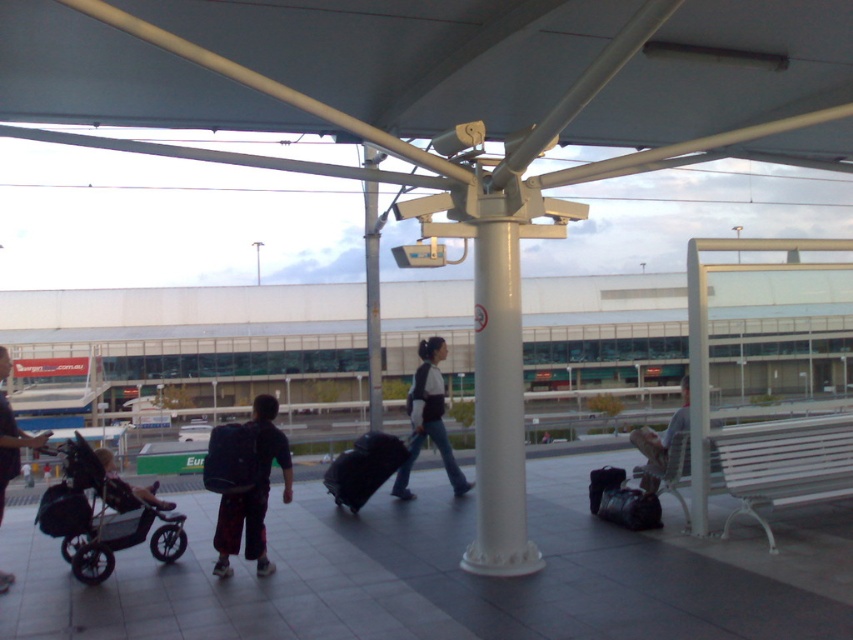
Question: Which object appears farthest from the camera in this image?

Choices:
 (A) black fabric suitcase at center
 (B) dark blue backpack at lower left
 (C) light brown fabric bag at center
 (D) matte black backpack at center

Answer: (D)

Question: Is dark blue backpack at center thinner than light brown fabric bag at center?

Choices:
 (A) yes
 (B) no

Answer: (A)

Question: Is black fabric suitcase at center closer to the viewer compared to dark blue backpack at lower left?

Choices:
 (A) yes
 (B) no

Answer: (B)

Question: Is dark blue backpack at center closer to the viewer compared to dark blue backpack at left?

Choices:
 (A) yes
 (B) no

Answer: (B)

Question: Which point appears closest to the camera in this image?

Choices:
 (A) (442, 340)
 (B) (376, 452)
 (C) (239, 476)
 (D) (120, 541)

Answer: (C)

Question: Which object is the farthest from the black fabric suitcase at center?

Choices:
 (A) black rubber baby carriage at lower left
 (B) dark blue backpack at lower left
 (C) light brown fabric bag at center
 (D) matte black backpack at center

Answer: (C)